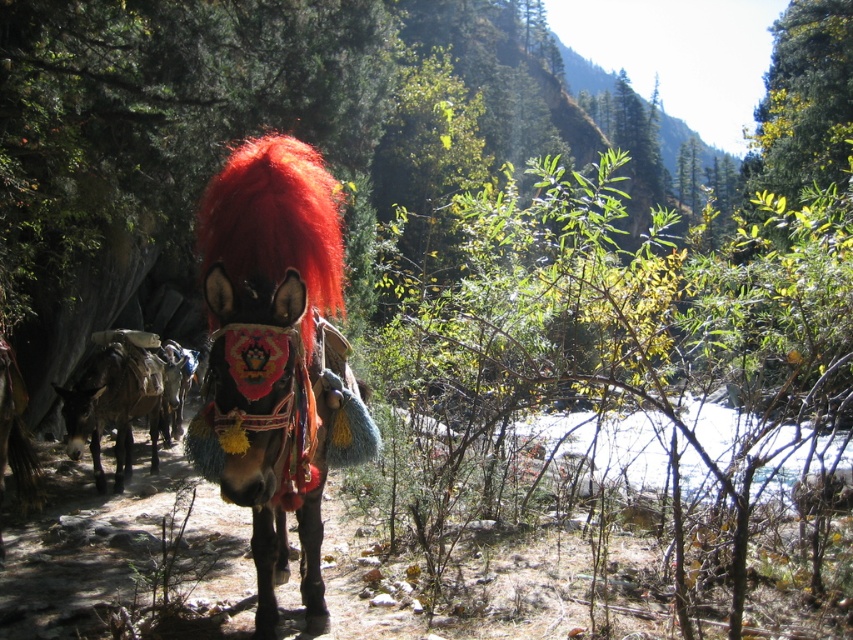
The image size is (853, 640). Find the location of `dark brown leather donkey at left`. dark brown leather donkey at left is located at coordinates (113, 404).

Between point (148, 406) and point (183, 358), which one is positioned in front?

Point (148, 406) is in front.

Is point (84, 429) positioned in front of point (183, 353)?

Yes.

Identify the location of dark brown leather donkey at left. (113, 404).

Between shiny black donkey at center and dark brown leather donkey at left, which one has less height?

dark brown leather donkey at left

Which is above, shiny black donkey at center or dark brown leather donkey at left?

shiny black donkey at center is higher up.

Which is in front, point (263, 451) or point (97, 392)?

Point (263, 451) is in front.

The height and width of the screenshot is (640, 853). What are the coordinates of `shiny black donkey at center` in the screenshot? It's located at (263, 428).

Does shiny black donkey at center have a lesser height compared to shiny red mane at center?

Incorrect, shiny black donkey at center's height does not fall short of shiny red mane at center's.

Who is more distant from viewer, (310, 419) or (329, 268)?

Positioned behind is point (310, 419).

Find the location of a particular element. The image size is (853, 640). shiny black donkey at center is located at coordinates (263, 428).